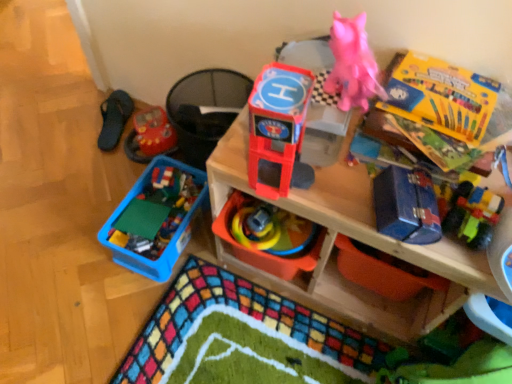
Question: From a real-world perspective, does blue metallic toolbox at right, placed as the 4th toy when sorted from back to front, sit lower than blue metallic toolbox at upper right, positioned as the 3th storage box in top-to-bottom order?

Choices:
 (A) no
 (B) yes

Answer: (A)

Question: Considering the relative sizes of blue metallic toolbox at right, marked as the second toy in a front-to-back arrangement, and blue metallic toolbox at upper right, positioned as the 3th storage box in top-to-bottom order, in the image provided, is blue metallic toolbox at right, marked as the second toy in a front-to-back arrangement, smaller than blue metallic toolbox at upper right, positioned as the 3th storage box in top-to-bottom order,?

Choices:
 (A) yes
 (B) no

Answer: (A)

Question: Is blue metallic toolbox at right, placed as the 4th toy when sorted from back to front, closer to camera compared to blue metallic toolbox at upper right, placed as the first storage box when sorted from bottom to top?

Choices:
 (A) no
 (B) yes

Answer: (B)

Question: Does blue metallic toolbox at right, placed as the 4th toy when sorted from back to front, appear on the left side of blue metallic toolbox at upper right, positioned as the 3th storage box in top-to-bottom order?

Choices:
 (A) no
 (B) yes

Answer: (B)

Question: Could you tell me if blue metallic toolbox at right, marked as the second toy in a front-to-back arrangement, is turned towards blue metallic toolbox at upper right, positioned as the 3th storage box in top-to-bottom order?

Choices:
 (A) yes
 (B) no

Answer: (B)

Question: Can you confirm if blue metallic toolbox at right, marked as the second toy in a front-to-back arrangement, is thinner than blue metallic toolbox at upper right, positioned as the 3th storage box in top-to-bottom order?

Choices:
 (A) yes
 (B) no

Answer: (A)

Question: From the image's perspective, is rubberized plastic toy at center, placed as the 3th toy when sorted from front to back, above matte plastic toy at upper center, which is the second storage box in bottom-to-top order?

Choices:
 (A) no
 (B) yes

Answer: (A)

Question: Considering the relative positions of rubberized plastic toy at center, placed as the 3th toy when sorted from front to back, and matte plastic toy at upper center, which appears as the second storage box when viewed from the top, in the image provided, is rubberized plastic toy at center, placed as the 3th toy when sorted from front to back, behind matte plastic toy at upper center, which appears as the second storage box when viewed from the top,?

Choices:
 (A) yes
 (B) no

Answer: (A)

Question: Does rubberized plastic toy at center, which is the 3th toy in back-to-front order, have a lesser height compared to matte plastic toy at upper center, which appears as the second storage box when viewed from the top?

Choices:
 (A) yes
 (B) no

Answer: (A)

Question: Can you confirm if rubberized plastic toy at center, placed as the 3th toy when sorted from front to back, is bigger than matte plastic toy at upper center, which is the second storage box in bottom-to-top order?

Choices:
 (A) yes
 (B) no

Answer: (B)

Question: Can you confirm if rubberized plastic toy at center, placed as the 3th toy when sorted from front to back, is thinner than matte plastic toy at upper center, which is the second storage box in bottom-to-top order?

Choices:
 (A) yes
 (B) no

Answer: (A)

Question: Is rubberized plastic toy at center, which is the 3th toy in back-to-front order, to the left of matte plastic toy at upper center, which appears as the second storage box when viewed from the top, from the viewer's perspective?

Choices:
 (A) yes
 (B) no

Answer: (A)

Question: From a real-world perspective, is yellow cardboard box at upper right, arranged as the first storage box when viewed from the top, on top of black fabric slipper at left?

Choices:
 (A) no
 (B) yes

Answer: (B)